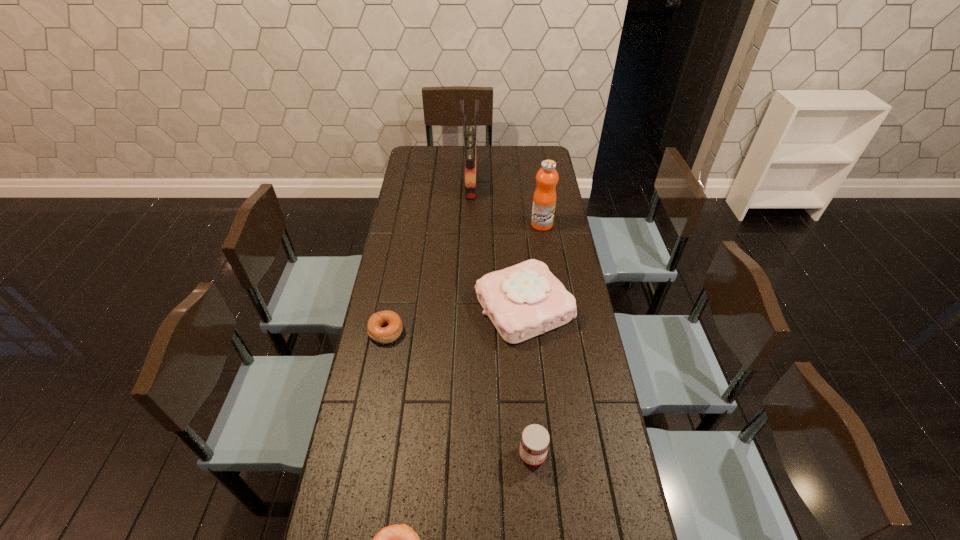
This screenshot has width=960, height=540. What are the coordinates of `free space that satisfies the following two spatial constraints: 1. on the front-facing side of the farthest object; 2. on the left side of the fourth tallest object` in the screenshot? It's located at (464, 455).

Locate an element on the screen. The height and width of the screenshot is (540, 960). vacant space that satisfies the following two spatial constraints: 1. on the back side of the fifth nearest object; 2. on the right side of the jam is located at coordinates (513, 225).

This screenshot has width=960, height=540. In order to click on free spot that satisfies the following two spatial constraints: 1. on the back side of the cake; 2. on the front-facing side of the shopping bag in this screenshot , I will do `click(513, 183)`.

This screenshot has width=960, height=540. In order to click on vacant position in the image that satisfies the following two spatial constraints: 1. on the front-facing side of the tallest object; 2. on the left side of the fourth tallest object in this screenshot , I will do `click(464, 455)`.

This screenshot has height=540, width=960. In order to click on vacant space that satisfies the following two spatial constraints: 1. on the front-facing side of the jam; 2. on the right side of the tallest object in this screenshot , I will do `click(464, 455)`.